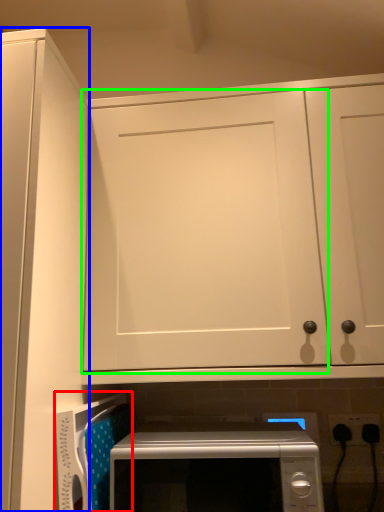
Question: Based on their relative distances, which object is farther from appliance (highlighted by a red box)? Choose from door (highlighted by a blue box) and door (highlighted by a green box).

Choices:
 (A) door
 (B) door

Answer: (B)